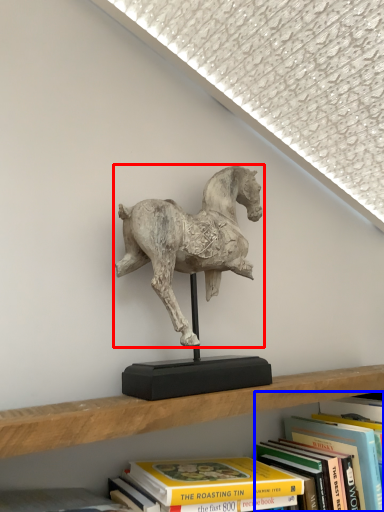
Question: Among these objects, which one is nearest to the camera, horse (highlighted by a red box) or book (highlighted by a blue box)?

Choices:
 (A) horse
 (B) book

Answer: (A)